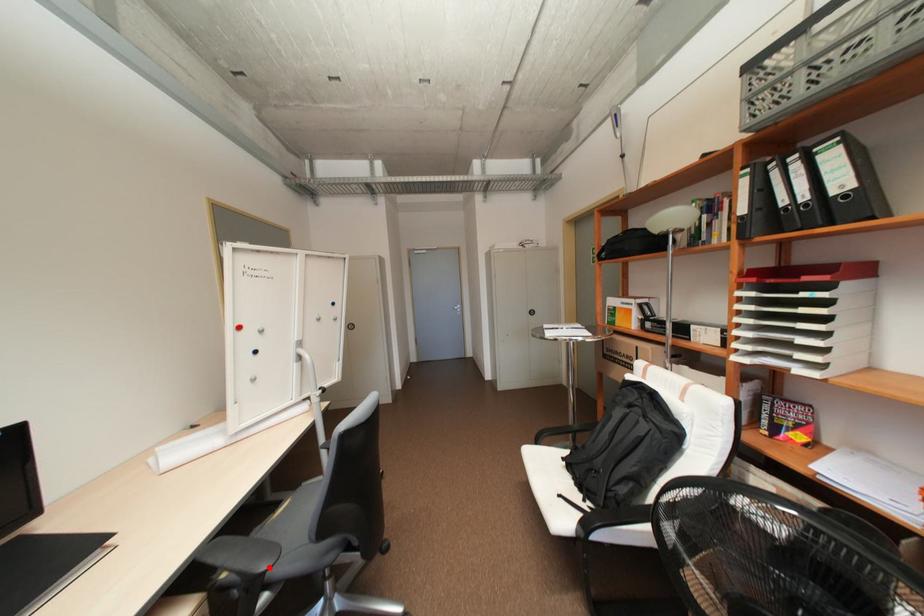
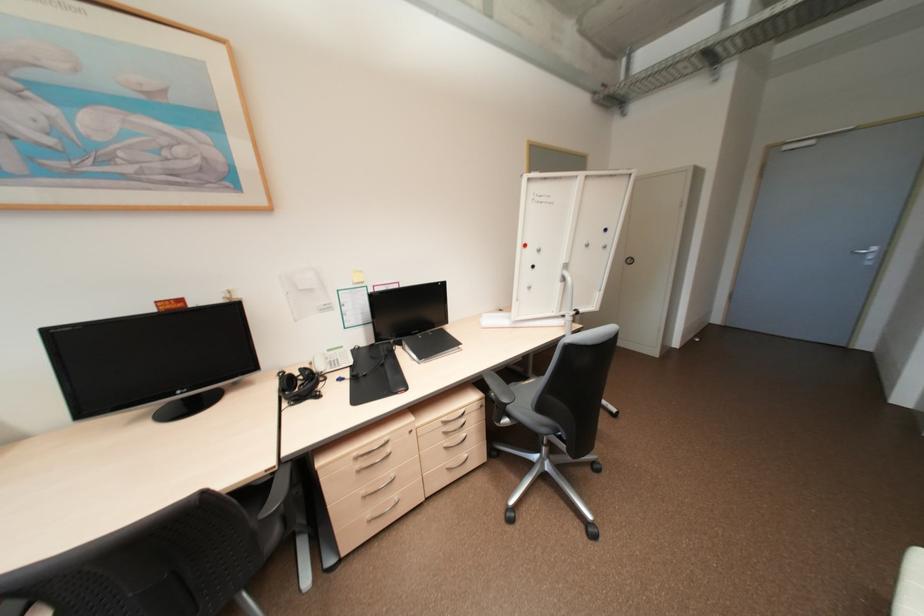
In the second image, find the point that corresponds to the highlighted location in the first image.

(511, 400)